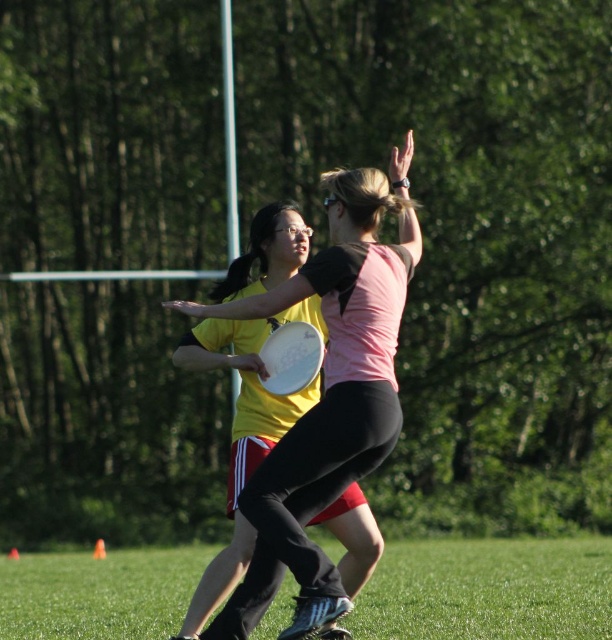
Question: Can you confirm if green grass at lower center is wider than white matte frisbee at center?

Choices:
 (A) no
 (B) yes

Answer: (B)

Question: Which is nearer to the green grass at lower center?

Choices:
 (A) white matte frisbee at center
 (B) matte white frisbee at center

Answer: (A)

Question: Where is green grass at lower center located in relation to white matte frisbee at center in the image?

Choices:
 (A) left
 (B) right

Answer: (A)

Question: Considering the real-world distances, which object is closest to the matte white frisbee at center?

Choices:
 (A) white matte frisbee at center
 (B) green grass at lower center

Answer: (A)

Question: Can you confirm if green grass at lower center is wider than matte white frisbee at center?

Choices:
 (A) yes
 (B) no

Answer: (A)

Question: Estimate the real-world distances between objects in this image. Which object is farther from the matte white frisbee at center?

Choices:
 (A) white matte frisbee at center
 (B) green grass at lower center

Answer: (B)